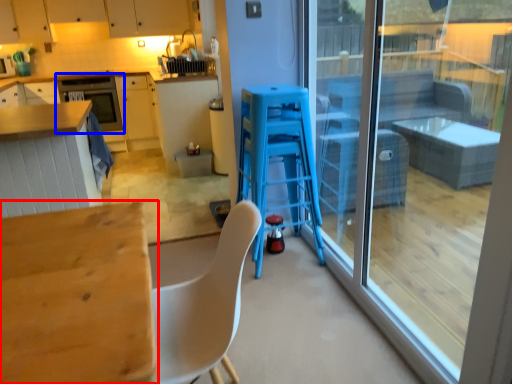
Question: Which of the following is the farthest to the observer, table (highlighted by a red box) or oven (highlighted by a blue box)?

Choices:
 (A) table
 (B) oven

Answer: (B)